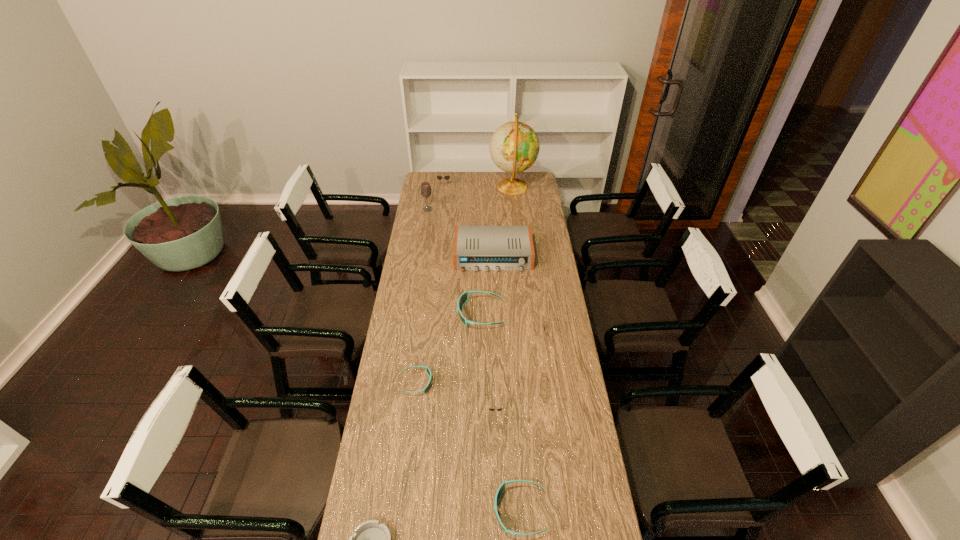
Where is `the smallest black sunglasses`? the smallest black sunglasses is located at coordinates (491, 409).

Locate an element on the screen. the second smallest cyan sunglasses is located at coordinates (502, 487).

Locate an element on the screen. The width and height of the screenshot is (960, 540). the nearest sunglasses is located at coordinates (502, 487).

Where is `the seventh farthest object`? the seventh farthest object is located at coordinates (428, 370).

The image size is (960, 540). In order to click on the second farthest cyan sunglasses in this screenshot , I will do `click(428, 370)`.

You are a GUI agent. You are given a task and a screenshot of the screen. Output one action in this format:
    pyautogui.click(x=<x>, y=<y>)
    Task: Click on the vacant space located 0.110m on the left of the globe
    The image size is (960, 540).
    Given the screenshot: What is the action you would take?
    pyautogui.click(x=471, y=187)

Identify the location of vacant space positioned on the right of the ninth shortest object. The image size is (960, 540). (455, 209).

Where is `vacant space located 0.100m in front of the lenses of the leftmost black sunglasses`? Image resolution: width=960 pixels, height=540 pixels. vacant space located 0.100m in front of the lenses of the leftmost black sunglasses is located at coordinates (443, 197).

Where is `vacant point located on the front panel of the seventh nearest object`? The height and width of the screenshot is (540, 960). vacant point located on the front panel of the seventh nearest object is located at coordinates (495, 324).

At what (x,y) coordinates should I click in order to perform the action: click on free space located in front of the lenses of the second nearest black sunglasses. Please return your answer as a coordinate pair (x, y). This screenshot has width=960, height=540. Looking at the image, I should click on (480, 333).